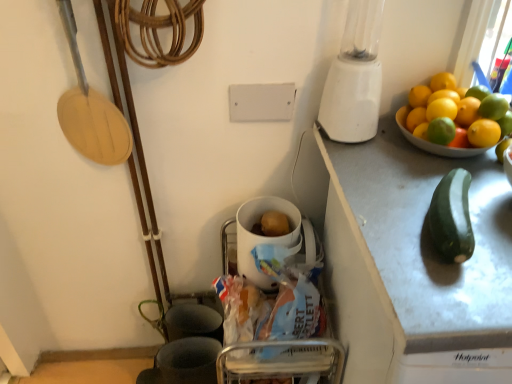
The image size is (512, 384). I want to click on vacant space to the left of yellow matte lemon at right, the second lemon from the bottom, so click(390, 168).